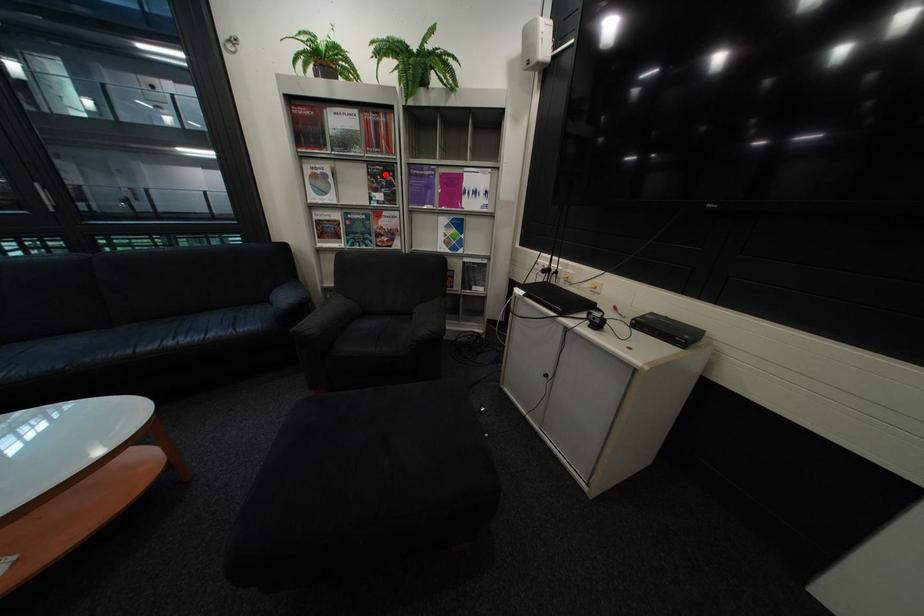
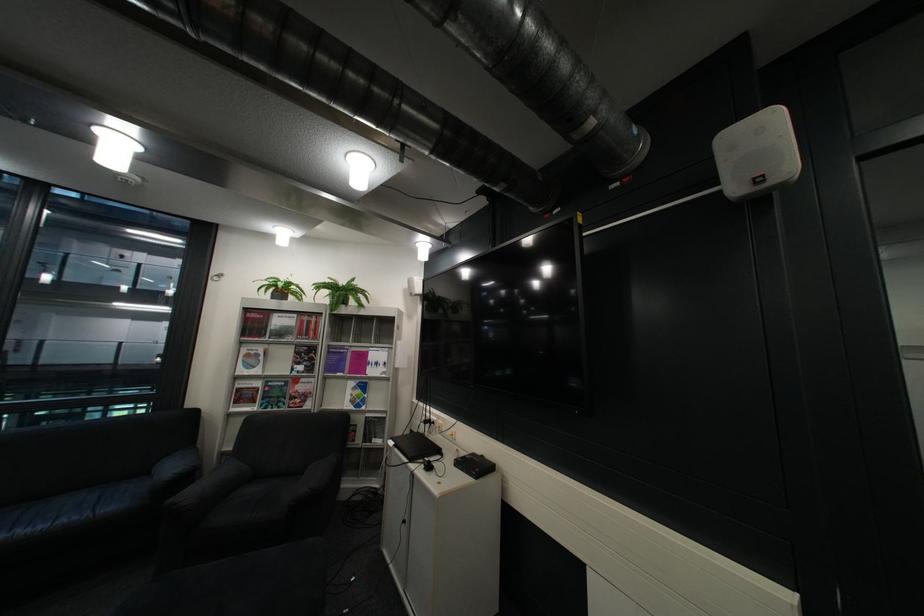
Question: I am providing you with two images of the same scene from different viewpoints. Image1 has a red point marked. In image2, the corresponding 3D location appears at what relative position? Reply with the corresponding letter.

Choices:
 (A) Closer
 (B) Farther

Answer: (B)